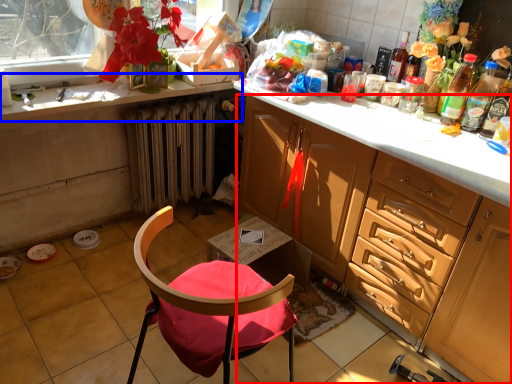
Question: Which point is closer to the camera, cabinetry (highlighted by a red box) or countertop (highlighted by a blue box)?

Choices:
 (A) cabinetry
 (B) countertop

Answer: (A)